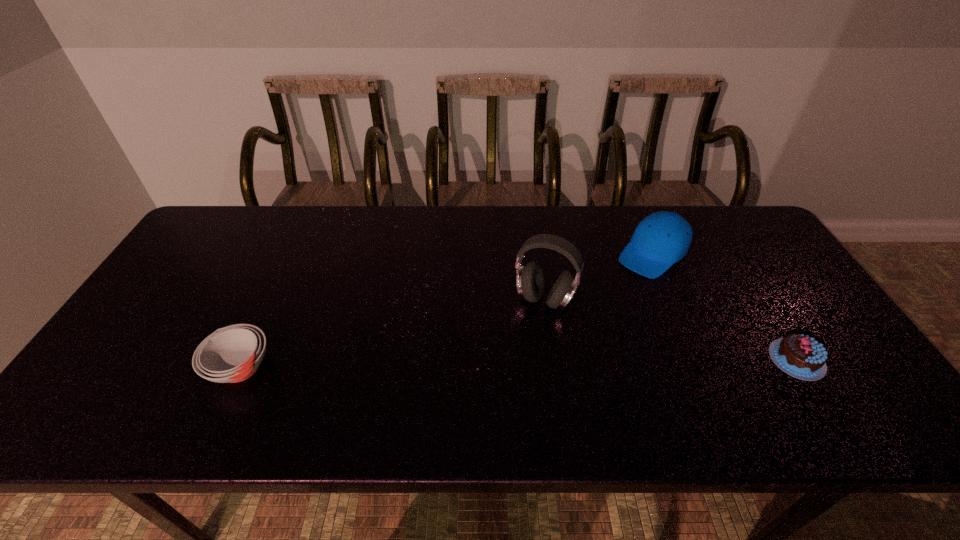
You are a GUI agent. You are given a task and a screenshot of the screen. Output one action in this format:
    pyautogui.click(x=<x>, y=<y>)
    Task: Click on the vacant point located on the front-facing side of the farthest object
    
    Given the screenshot: What is the action you would take?
    pyautogui.click(x=567, y=332)

I want to click on free location located on the ear cups of the second farthest object, so click(496, 379).

I want to click on free space located 0.180m on the ear cups of the second farthest object, so click(503, 366).

The width and height of the screenshot is (960, 540). I want to click on vacant area situated on the ear cups of the second farthest object, so click(499, 373).

Identify the location of object that is at the far edge. (663, 238).

At what (x,y) coordinates should I click in order to perform the action: click on soup bowl positioned at the near edge. Please return your answer as a coordinate pair (x, y). Image resolution: width=960 pixels, height=540 pixels. Looking at the image, I should click on (232, 354).

Where is `chocolate cake located in the near edge section of the desktop`? Image resolution: width=960 pixels, height=540 pixels. chocolate cake located in the near edge section of the desktop is located at coordinates (800, 356).

At what (x,y) coordinates should I click in order to perform the action: click on object positioned at the right edge. Please return your answer as a coordinate pair (x, y). This screenshot has height=540, width=960. Looking at the image, I should click on (800, 356).

In order to click on object at the near right corner in this screenshot , I will do `click(800, 356)`.

Image resolution: width=960 pixels, height=540 pixels. I want to click on vacant space at the far edge, so click(420, 246).